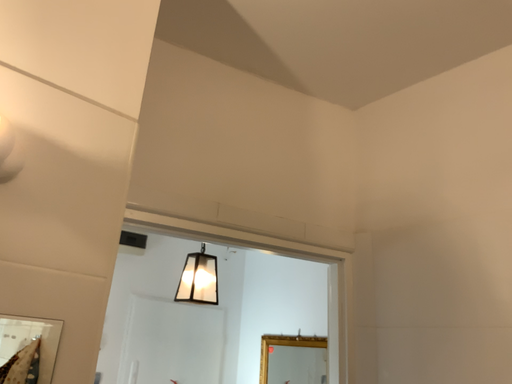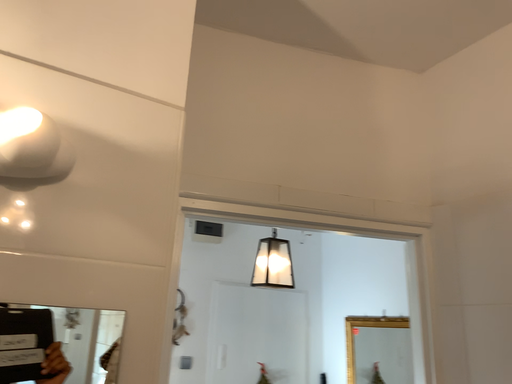
Question: Which way did the camera rotate in the video?

Choices:
 (A) rotated right
 (B) rotated left

Answer: (B)